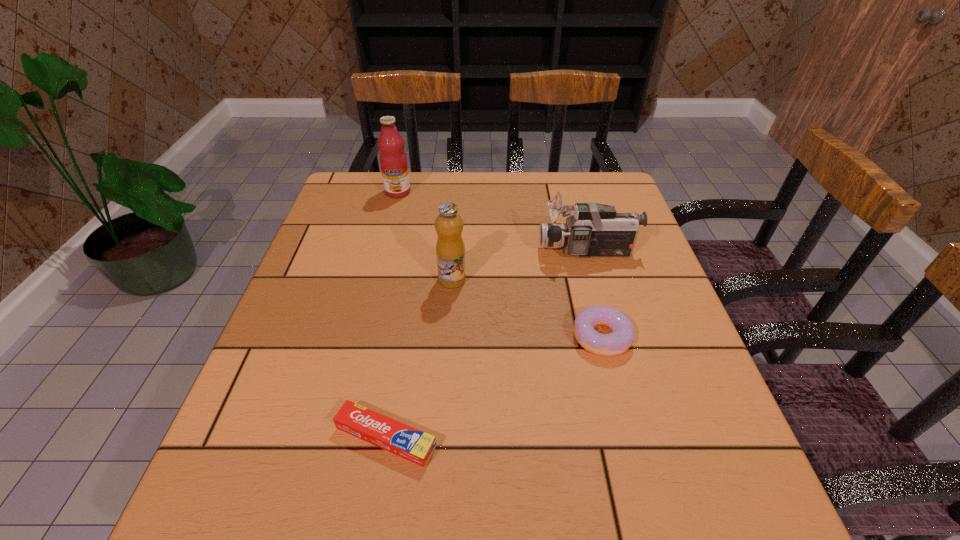
Where is `vacant space that satisfies the following two spatial constraints: 1. on the label of the second shortest object; 2. on the right side of the farthest object`? vacant space that satisfies the following two spatial constraints: 1. on the label of the second shortest object; 2. on the right side of the farthest object is located at coordinates (362, 336).

Identify the location of free space that satisfies the following two spatial constraints: 1. on the back side of the second shortest object; 2. on the front label of the right fruit juice. The image size is (960, 540). (587, 280).

You are a GUI agent. You are given a task and a screenshot of the screen. Output one action in this format:
    pyautogui.click(x=<x>, y=<y>)
    Task: Click on the free location that satisfies the following two spatial constraints: 1. on the label of the farther fruit juice; 2. on the right side of the toothpaste
    
    Given the screenshot: What is the action you would take?
    pyautogui.click(x=336, y=437)

The height and width of the screenshot is (540, 960). Find the location of `free region that satisfies the following two spatial constraints: 1. on the label of the left fruit juice; 2. on the right side of the toothpaste`. free region that satisfies the following two spatial constraints: 1. on the label of the left fruit juice; 2. on the right side of the toothpaste is located at coordinates (336, 437).